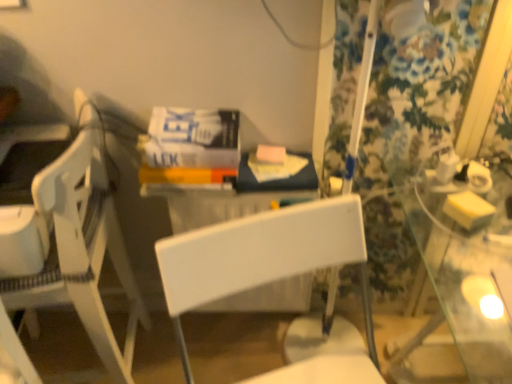
Measure the distance between point (397, 54) and camera.

Point (397, 54) and camera are 1.00 meters apart.

Where is `white plastic chair at center, the 2th chair viewed from the left`? This screenshot has width=512, height=384. white plastic chair at center, the 2th chair viewed from the left is located at coordinates pos(270,273).

What do you see at coordinates (270, 273) in the screenshot?
I see `white plastic chair at center, placed as the 1th chair when sorted from right to left` at bounding box center [270, 273].

Find the location of `floral fabric curtain at right`. floral fabric curtain at right is located at coordinates (418, 85).

Which point is more forward, (x=420, y=49) or (x=314, y=223)?

The point (x=314, y=223) is closer to the camera.

From the image's perspective, does floral fabric curtain at right appear lower than white plastic chair at center, the 2th chair viewed from the left?

No, from the image's perspective, floral fabric curtain at right is not below white plastic chair at center, the 2th chair viewed from the left.

From a real-world perspective, is floral fabric curtain at right over white plastic chair at center, the 2th chair viewed from the left?

Correct, in the physical world, floral fabric curtain at right is higher than white plastic chair at center, the 2th chair viewed from the left.

Is floral fabric curtain at right next to white plastic chair at center, the 2th chair viewed from the left?

There is a gap between floral fabric curtain at right and white plastic chair at center, the 2th chair viewed from the left.

Which is behind, point (213, 285) or point (410, 125)?

The point (410, 125) is behind.

Is white plastic chair at center, placed as the 1th chair when sorted from right to left, aimed at floral fabric curtain at right?

No, white plastic chair at center, placed as the 1th chair when sorted from right to left, is not aimed at floral fabric curtain at right.

Which object is wider, white plastic chair at center, the 2th chair viewed from the left, or floral fabric curtain at right?

With larger width is white plastic chair at center, the 2th chair viewed from the left.

Between point (367, 362) and point (34, 197), which one is positioned behind?

The point (367, 362) is farther from the camera.

Can you confirm if white plastic chair at center, placed as the 1th chair when sorted from right to left, is smaller than white plastic chair at left, the 1th chair from the left?

Yes.

Is white plastic chair at center, placed as the 1th chair when sorted from right to left, not inside white plastic chair at left, which is the second chair in right-to-left order?

Indeed, white plastic chair at center, placed as the 1th chair when sorted from right to left, is completely outside white plastic chair at left, which is the second chair in right-to-left order.

Where is `chair in front of the white plastic chair at left, which is the second chair in right-to-left order`? chair in front of the white plastic chair at left, which is the second chair in right-to-left order is located at coordinates (270, 273).

From a real-world perspective, which is physically below, white plastic chair at left, the 1th chair from the left, or white plastic chair at center, placed as the 1th chair when sorted from right to left?

white plastic chair at center, placed as the 1th chair when sorted from right to left, from a real-world perspective.

Who is shorter, white plastic chair at left, which is the second chair in right-to-left order, or white plastic chair at center, placed as the 1th chair when sorted from right to left?

white plastic chair at center, placed as the 1th chair when sorted from right to left.

Does white plastic chair at left, which is the second chair in right-to-left order, appear on the right side of white plastic chair at center, the 2th chair viewed from the left?

No, white plastic chair at left, which is the second chair in right-to-left order, is not to the right of white plastic chair at center, the 2th chair viewed from the left.

Find the location of a particular element. This screenshot has width=512, height=384. the 1st chair positioned below the floral fabric curtain at right (from the image's perspective) is located at coordinates (70, 249).

From a real-world perspective, is floral fabric curtain at right positioned over white plastic chair at left, which is the second chair in right-to-left order, based on gravity?

Yes, from a real-world perspective, floral fabric curtain at right is above white plastic chair at left, which is the second chair in right-to-left order.

Which of these two, floral fabric curtain at right or white plastic chair at left, which is the second chair in right-to-left order, is wider?

white plastic chair at left, which is the second chair in right-to-left order, is wider.

Does white plastic chair at left, which is the second chair in right-to-left order, touch floral fabric curtain at right?

They are not placed beside each other.

Locate an element on the screen. This screenshot has width=512, height=384. curtain on the right of white plastic chair at left, the 1th chair from the left is located at coordinates (418, 85).

Considering the sizes of white plastic chair at left, the 1th chair from the left, and floral fabric curtain at right in the image, is white plastic chair at left, the 1th chair from the left, bigger or smaller than floral fabric curtain at right?

In the image, white plastic chair at left, the 1th chair from the left, appears to be larger than floral fabric curtain at right.

Is white plastic chair at left, which is the second chair in right-to-left order, to the left of floral fabric curtain at right from the viewer's perspective?

Indeed, white plastic chair at left, which is the second chair in right-to-left order, is positioned on the left side of floral fabric curtain at right.

Identify the location of curtain to the right of white plastic chair at center, placed as the 1th chair when sorted from right to left. This screenshot has width=512, height=384. (418, 85).

From the image's perspective, starting from the floral fabric curtain at right, which chair is the 2nd one below? Please provide its 2D coordinates.

[(270, 273)]

When comparing their distances from white plastic chair at center, placed as the 1th chair when sorted from right to left, does floral fabric curtain at right or white plastic chair at left, the 1th chair from the left, seem further?

The object further to white plastic chair at center, placed as the 1th chair when sorted from right to left, is floral fabric curtain at right.

When comparing their distances from floral fabric curtain at right, does white plastic chair at left, the 1th chair from the left, or white plastic chair at center, the 2th chair viewed from the left, seem further?

white plastic chair at left, the 1th chair from the left, lies further to floral fabric curtain at right than the other object.

From the image, which object appears to be nearer to floral fabric curtain at right, white plastic chair at center, the 2th chair viewed from the left, or white plastic chair at left, the 1th chair from the left?

Based on the image, white plastic chair at center, the 2th chair viewed from the left, appears to be nearer to floral fabric curtain at right.

Considering their positions, is white plastic chair at center, placed as the 1th chair when sorted from right to left, positioned further to white plastic chair at left, the 1th chair from the left, than floral fabric curtain at right?

floral fabric curtain at right.

Looking at the image, which one is located further to white plastic chair at center, placed as the 1th chair when sorted from right to left, white plastic chair at left, the 1th chair from the left, or floral fabric curtain at right?

Based on the image, floral fabric curtain at right appears to be further to white plastic chair at center, placed as the 1th chair when sorted from right to left.

Looking at the image, which one is located further to white plastic chair at left, which is the second chair in right-to-left order, floral fabric curtain at right or white plastic chair at center, the 2th chair viewed from the left?

floral fabric curtain at right lies further to white plastic chair at left, which is the second chair in right-to-left order, than the other object.

This screenshot has height=384, width=512. I want to click on chair located between white plastic chair at left, the 1th chair from the left, and floral fabric curtain at right in the left-right direction, so click(270, 273).